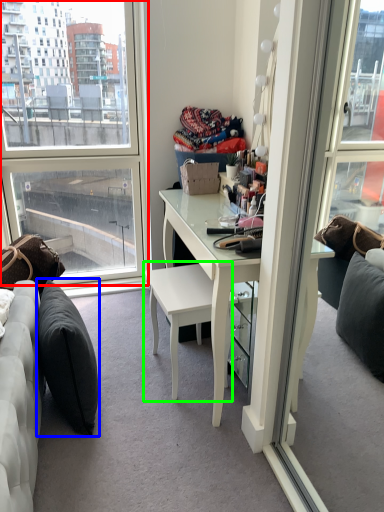
Question: Estimate the real-world distances between objects in this image. Which object is farther from window (highlighted by a red box), pillow (highlighted by a blue box) or chair (highlighted by a green box)?

Choices:
 (A) pillow
 (B) chair

Answer: (B)